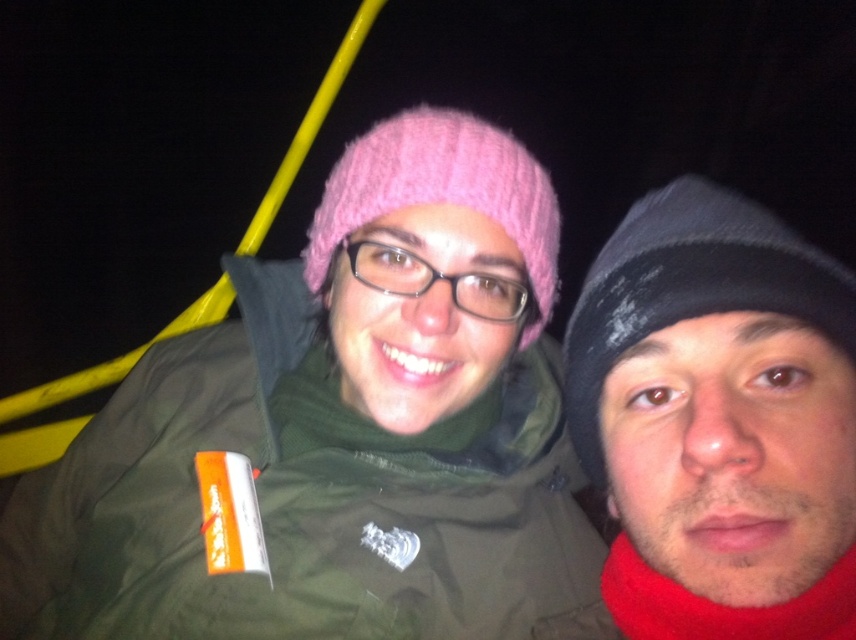
Question: Is black knit beanie at right to the left of pink knitted hat at center from the viewer's perspective?

Choices:
 (A) yes
 (B) no

Answer: (B)

Question: Is black knit beanie at right positioned in front of pink knitted hat at center?

Choices:
 (A) yes
 (B) no

Answer: (A)

Question: Is black knit beanie at right bigger than pink knitted hat at center?

Choices:
 (A) no
 (B) yes

Answer: (A)

Question: Which point appears farthest from the camera in this image?

Choices:
 (A) [474, 188]
 (B) [758, 227]

Answer: (A)

Question: Among these objects, which one is farthest from the camera?

Choices:
 (A) black knit beanie at right
 (B) pink knitted hat at center

Answer: (B)